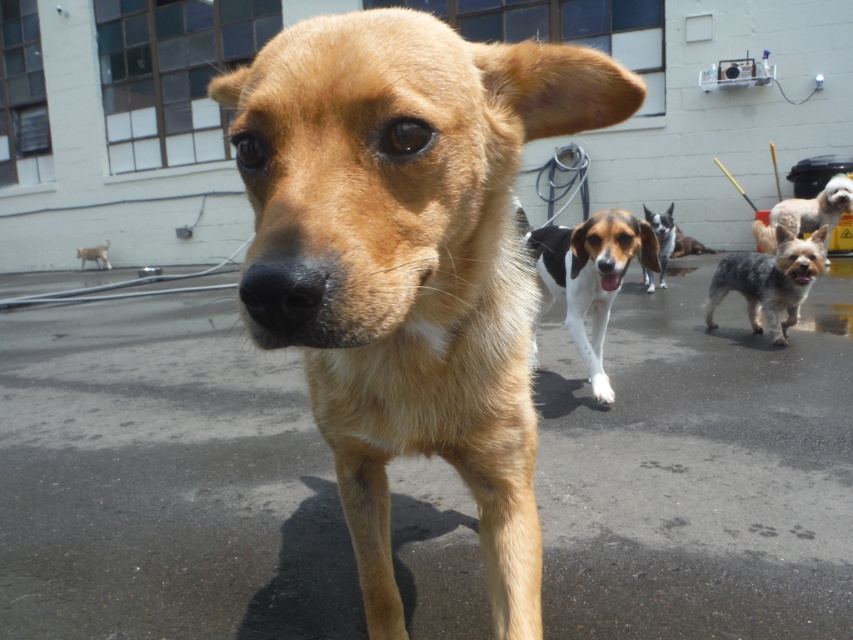
Question: Which object is the closest to the golden fur beagle at center?

Choices:
 (A) spotted fur dog at center
 (B) white and black spotted dog at center
 (C) white/black fur dog at center

Answer: (C)

Question: Among these objects, which one is nearest to the camera?

Choices:
 (A) light brown fur dog at center
 (B) short-haired white dog at center
 (C) white/black fur dog at center

Answer: (C)

Question: Which point is farther to the camera?

Choices:
 (A) light brown fur dog at center
 (B) white and black spotted dog at center

Answer: (A)

Question: Can you confirm if spotted fur dog at center is positioned to the right of short-haired white dog at center?

Choices:
 (A) yes
 (B) no

Answer: (B)

Question: Is the position of short-haired white dog at center less distant than that of white and black spotted dog at center?

Choices:
 (A) yes
 (B) no

Answer: (B)

Question: Where is golden fur beagle at center located in relation to light brown fur dog at center in the image?

Choices:
 (A) below
 (B) above

Answer: (A)